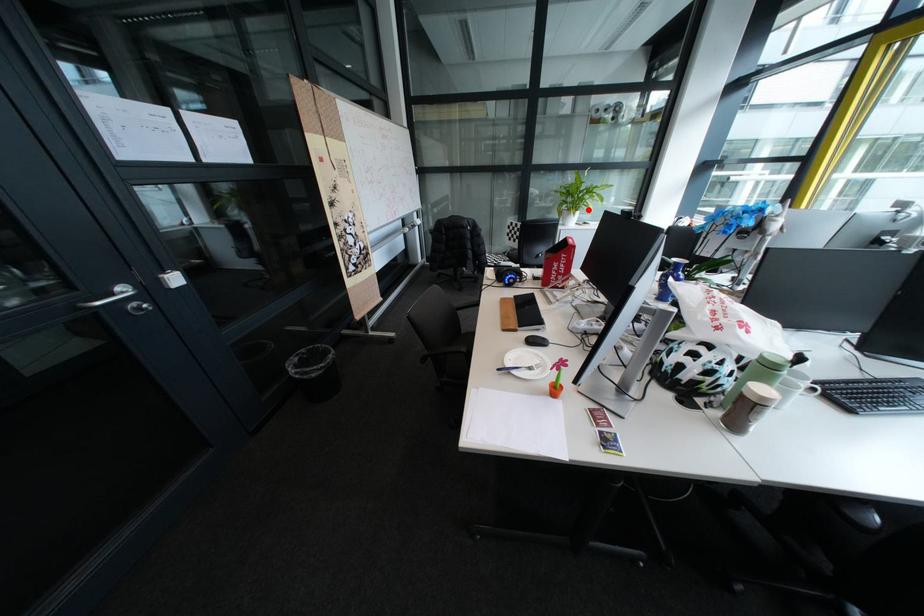
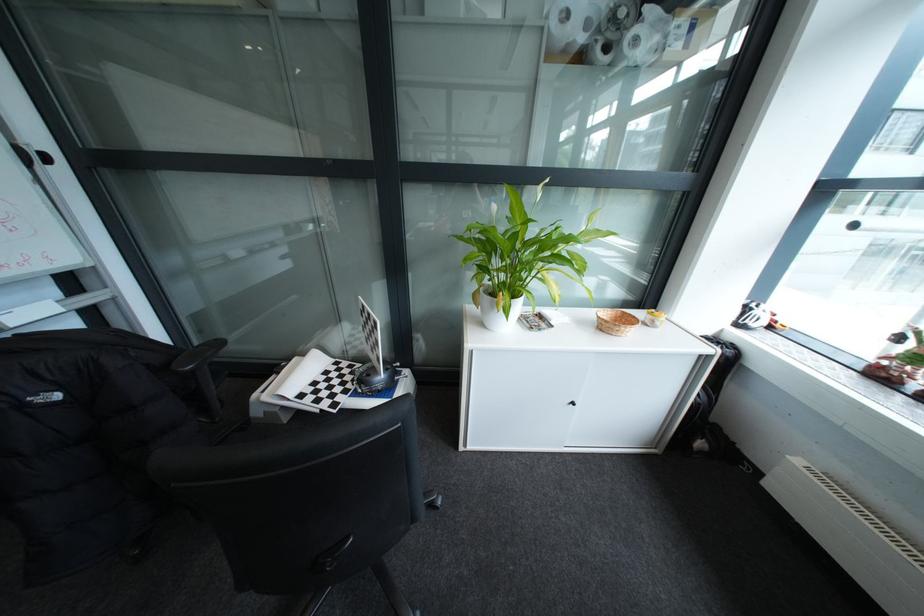
Question: I am providing you with two images of the same scene from different viewpoints. In image1, a red point is highlighted. Considering the same 3D point in image2, which of the following is correct?

Choices:
 (A) It is closer
 (B) It is farther

Answer: (B)